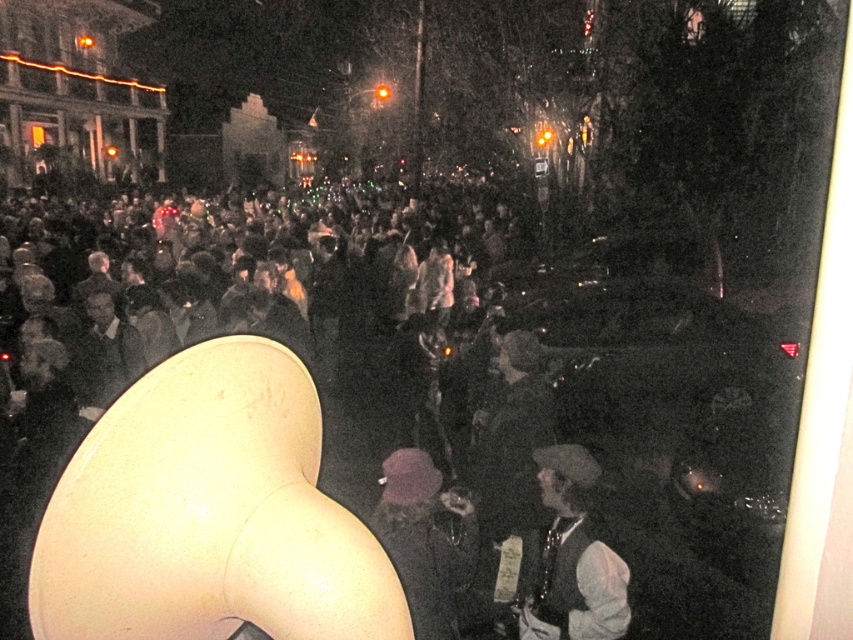
You are at a nighttime event and see both the white fabric hat at lower right and the purple fabric hat at center. Which hat is positioned lower in the image?

The white fabric hat at lower right is positioned lower than the purple fabric hat at center.

In the scene shown: You are a photographer trying to capture a clear shot of both the white matte megaphone at center and the purple fabric hat at center during the nighttime event. Since the megaphone is in front, will it block the view of the hat?

The white matte megaphone at center is taller than the purple fabric hat at center, so it may block part of the hat if positioned directly in front. Adjust your angle to ensure both are visible.

You are at a nighttime event and want to take a photo of the crowd. There are two points marked on your camera screen at coordinates point (x=360, y=388) and point (x=606, y=637). If you want to focus on the point that is closer to you, which coordinate should you choose?

Point (x=606, y=637) is closer to you than point (x=360, y=388), so you should choose point (x=606, y=637) to focus on the closer point.